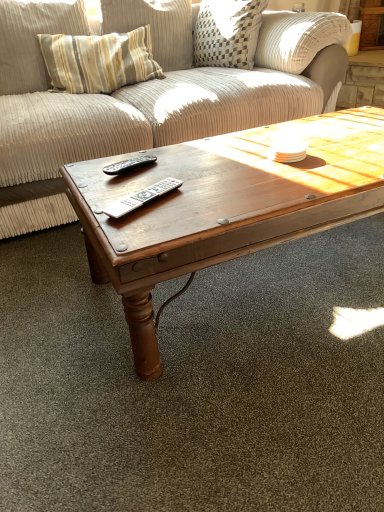
Identify the location of free space behind silver metallic remote at center, the first remote positioned from the bottom. tap(149, 174).